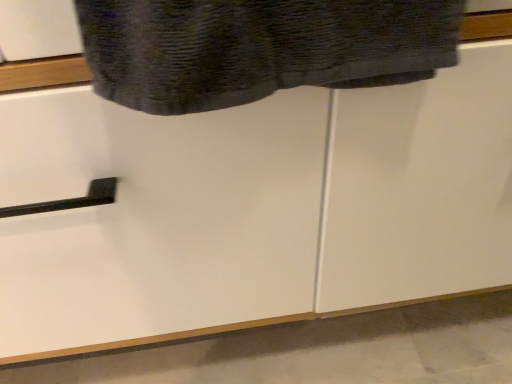
Measure the distance between point [81,17] and camera.

They are 11.10 inches apart.

What do you see at coordinates (259, 48) in the screenshot?
I see `textured dark gray towel at upper center` at bounding box center [259, 48].

The image size is (512, 384). I want to click on textured dark gray towel at upper center, so click(259, 48).

What is the approximate width of textured dark gray towel at upper center?

6.48 centimeters.

You are a GUI agent. You are given a task and a screenshot of the screen. Output one action in this format:
    pyautogui.click(x=<x>, y=<y>)
    Task: Click on the textured dark gray towel at upper center
    
    Given the screenshot: What is the action you would take?
    pyautogui.click(x=259, y=48)